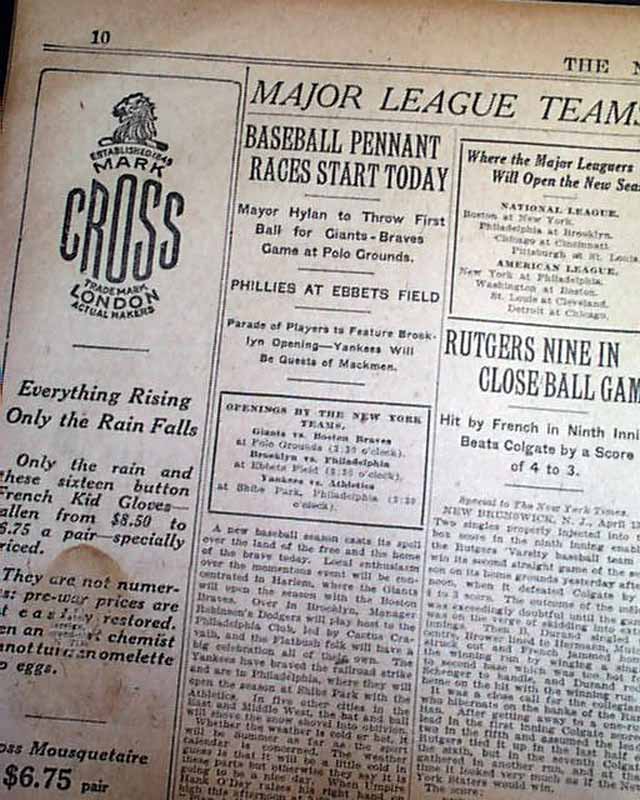
You are a GUI agent. You are given a task and a screenshot of the screen. Output one action in this format:
    pyautogui.click(x=<x>, y=<y>)
    Task: Click on the column
    The height and width of the screenshot is (800, 640).
    Given the screenshot: What is the action you would take?
    pyautogui.click(x=91, y=446), pyautogui.click(x=313, y=541), pyautogui.click(x=513, y=548)